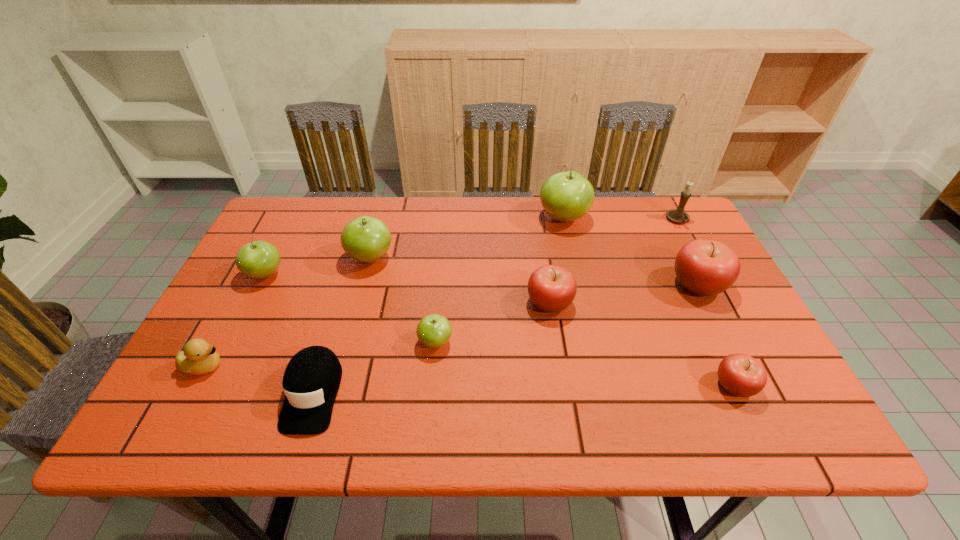
The height and width of the screenshot is (540, 960). Identify the location of free space between the third smallest green apple and the cap. (342, 326).

Where is `unoccupied position between the duckling and the biggest green apple`? The width and height of the screenshot is (960, 540). unoccupied position between the duckling and the biggest green apple is located at coordinates (384, 292).

Locate an element on the screen. This screenshot has width=960, height=540. vacant area that lies between the leftmost red apple and the biggest red apple is located at coordinates (624, 294).

Locate an element on the screen. vacant point located between the candle holder and the cap is located at coordinates (495, 307).

Locate an element on the screen. free space between the third smallest green apple and the farthest apple is located at coordinates (467, 238).

Where is `empty space between the rightmost green apple and the biggest red apple`? The width and height of the screenshot is (960, 540). empty space between the rightmost green apple and the biggest red apple is located at coordinates (631, 251).

Where is `blank region between the smallest red apple and the leftmost red apple`? The height and width of the screenshot is (540, 960). blank region between the smallest red apple and the leftmost red apple is located at coordinates (642, 344).

Locate an element on the screen. This screenshot has height=540, width=960. unoccupied area between the candle holder and the nearest red apple is located at coordinates (707, 303).

Locate an element on the screen. This screenshot has height=540, width=960. free spot between the cap and the second biggest green apple is located at coordinates (342, 326).

Where is `object that ranks as the fifth closest to the leftmost red apple`? object that ranks as the fifth closest to the leftmost red apple is located at coordinates (366, 239).